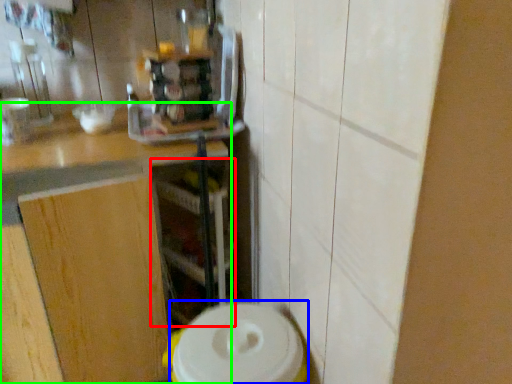
Question: Based on their relative distances, which object is farther from shelf (highlighted by a red box)? Choose from appliance (highlighted by a blue box) and countertop (highlighted by a green box).

Choices:
 (A) appliance
 (B) countertop

Answer: (A)